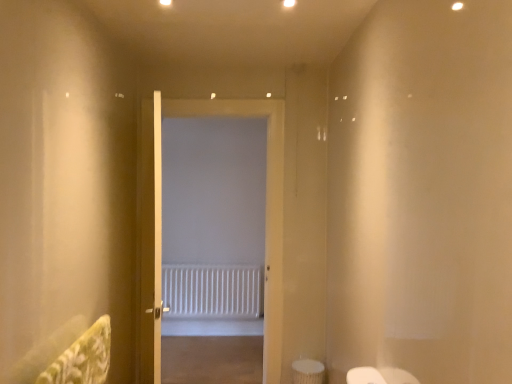
Question: From the image's perspective, is white matte door at center, the 1th door in the back-to-front sequence, located above or below white wooden door at center, placed as the 2th door when sorted from back to front?

Choices:
 (A) above
 (B) below

Answer: (A)

Question: From a real-world perspective, is white matte door at center, the 1th door in the back-to-front sequence, positioned above or below white wooden door at center, the first door from the front?

Choices:
 (A) below
 (B) above

Answer: (B)

Question: Estimate the real-world distances between objects in this image. Which object is closer to the white textured radiator at center?

Choices:
 (A) white wooden door at center, the first door from the front
 (B) white matte door at center, the 1th door in the back-to-front sequence

Answer: (B)

Question: Which of these objects is positioned closest to the white wooden door at center, placed as the 2th door when sorted from back to front?

Choices:
 (A) white matte door at center, which ranks as the second door in front-to-back order
 (B) white textured radiator at center

Answer: (A)